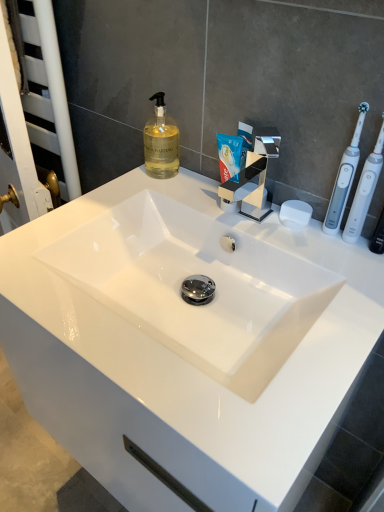
At what (x,y) coordinates should I click in order to perform the action: click on vacant area that lies between translucent glass soap dispenser at upper center and white plastic toothbrush at right, the 2th toothbrush in the right-to-left sequence. Please return your answer as a coordinate pair (x, y). The image size is (384, 512). Looking at the image, I should click on (217, 194).